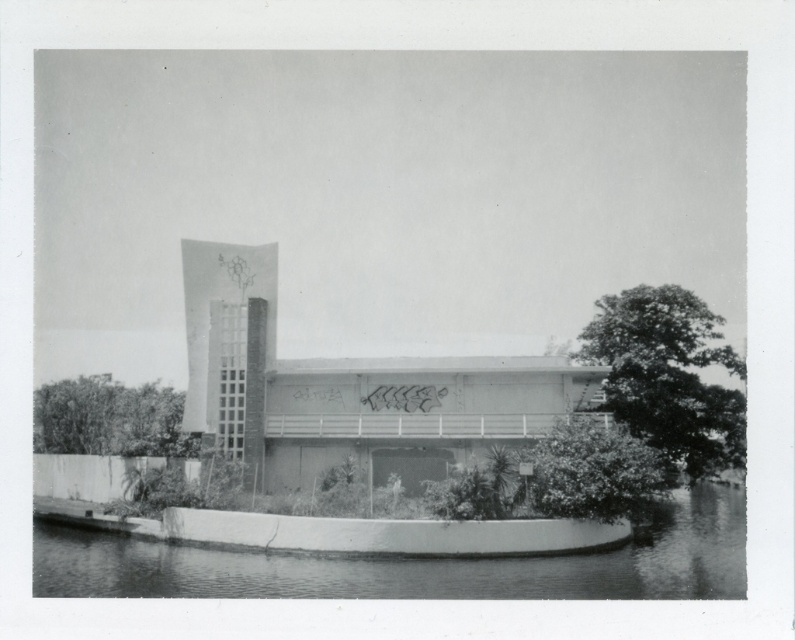
Question: Can you confirm if smooth concrete river at lower center is bigger than dark green leafy tree at right?

Choices:
 (A) yes
 (B) no

Answer: (B)

Question: Is smooth concrete river at lower center wider than green leafy tree at lower left?

Choices:
 (A) yes
 (B) no

Answer: (A)

Question: Estimate the real-world distances between objects in this image. Which object is farther from the green leafy tree at lower left?

Choices:
 (A) smooth concrete river at lower center
 (B) dark green leafy tree at right

Answer: (B)

Question: Among these objects, which one is nearest to the camera?

Choices:
 (A) smooth concrete river at lower center
 (B) dark green leafy tree at right
 (C) green leafy tree at lower left

Answer: (A)

Question: Which point appears closest to the camera in this image?

Choices:
 (A) (103, 584)
 (B) (630, 291)
 (C) (103, 442)

Answer: (A)

Question: Does smooth concrete river at lower center appear on the left side of green leafy tree at lower left?

Choices:
 (A) no
 (B) yes

Answer: (A)